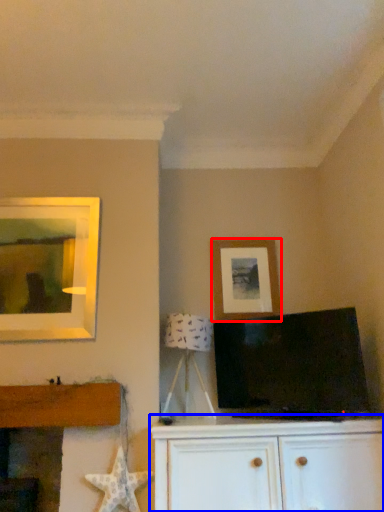
Question: Which object appears farthest to the camera in this image, picture frame (highlighted by a red box) or cabinetry (highlighted by a blue box)?

Choices:
 (A) picture frame
 (B) cabinetry

Answer: (A)